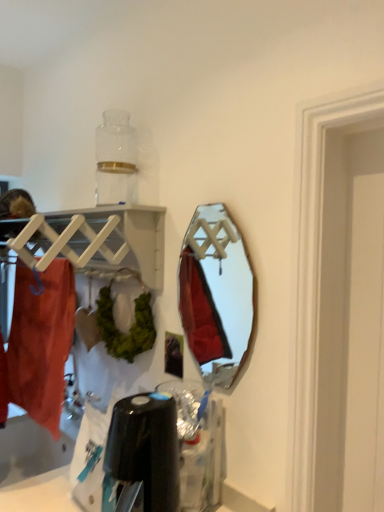
Question: Considering the relative sizes of metallic silver mirror at center and matte orange towel at left in the image provided, is metallic silver mirror at center wider than matte orange towel at left?

Choices:
 (A) yes
 (B) no

Answer: (B)

Question: Is metallic silver mirror at center oriented away from matte orange towel at left?

Choices:
 (A) no
 (B) yes

Answer: (A)

Question: Would you say metallic silver mirror at center is outside matte orange towel at left?

Choices:
 (A) no
 (B) yes

Answer: (B)

Question: Could you tell me if metallic silver mirror at center is facing matte orange towel at left?

Choices:
 (A) no
 (B) yes

Answer: (A)

Question: From a real-world perspective, does metallic silver mirror at center stand above matte orange towel at left?

Choices:
 (A) yes
 (B) no

Answer: (A)

Question: From the image's perspective, relative to white matte wooden shelf at upper left, is metallic silver mirror at center above or below?

Choices:
 (A) above
 (B) below

Answer: (B)

Question: Considering the positions of metallic silver mirror at center and white matte wooden shelf at upper left in the image, is metallic silver mirror at center taller or shorter than white matte wooden shelf at upper left?

Choices:
 (A) tall
 (B) short

Answer: (A)

Question: Is metallic silver mirror at center inside or outside of white matte wooden shelf at upper left?

Choices:
 (A) inside
 (B) outside

Answer: (B)

Question: Looking at their shapes, would you say metallic silver mirror at center is wider or thinner than white matte wooden shelf at upper left?

Choices:
 (A) wide
 (B) thin

Answer: (B)

Question: From a real-world perspective, relative to metallic silver mirror at center, is matte orange towel at left vertically above or below?

Choices:
 (A) above
 (B) below

Answer: (B)

Question: Is matte orange towel at left bigger or smaller than metallic silver mirror at center?

Choices:
 (A) small
 (B) big

Answer: (B)

Question: Considering the positions of point (54, 361) and point (243, 342), is point (54, 361) closer or farther from the camera than point (243, 342)?

Choices:
 (A) farther
 (B) closer

Answer: (B)

Question: Considering the positions of matte orange towel at left and metallic silver mirror at center in the image, is matte orange towel at left wider or thinner than metallic silver mirror at center?

Choices:
 (A) wide
 (B) thin

Answer: (A)

Question: From the image's perspective, is matte orange towel at left positioned above or below white matte wooden shelf at upper left?

Choices:
 (A) above
 (B) below

Answer: (B)

Question: Considering the positions of point (26, 377) and point (140, 271), is point (26, 377) closer or farther from the camera than point (140, 271)?

Choices:
 (A) closer
 (B) farther

Answer: (B)